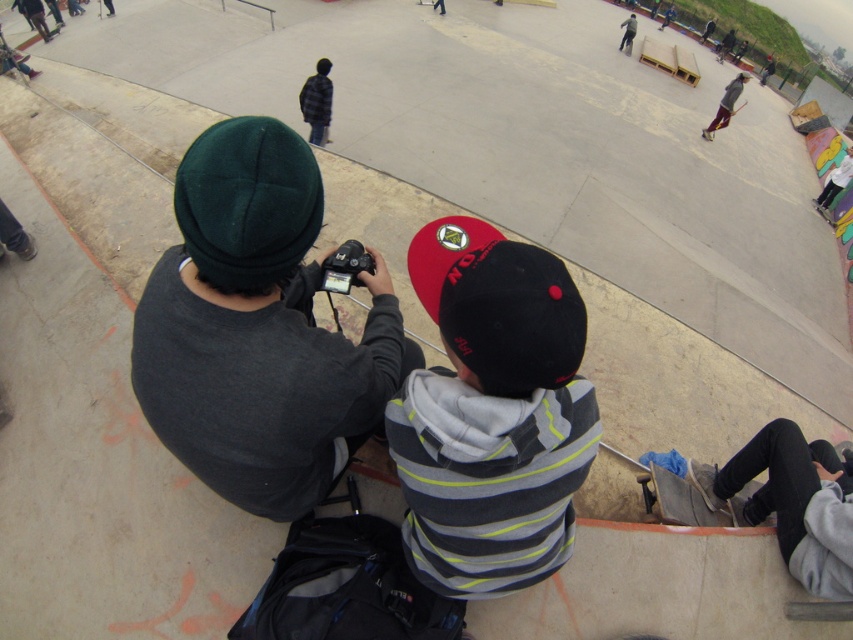
Who is taller, striped hoodie at center or wooden skateboard at lower right?

Standing taller between the two is striped hoodie at center.

Can you confirm if striped hoodie at center is shorter than wooden skateboard at lower right?

No, striped hoodie at center is not shorter than wooden skateboard at lower right.

Find the location of `striped hoodie at center`. striped hoodie at center is located at coordinates (492, 413).

This screenshot has width=853, height=640. Identify the location of striped hoodie at center. (492, 413).

Is point (234, 486) farther from camera compared to point (813, 202)?

No, it is in front of (813, 202).

Between dark gray fleece at left and wooden skateboard at center, which one appears on the left side from the viewer's perspective?

dark gray fleece at left is more to the left.

Does point (138, 378) lie behind point (821, 208)?

No, it is in front of (821, 208).

The width and height of the screenshot is (853, 640). Find the location of `dark gray fleece at left`. dark gray fleece at left is located at coordinates (258, 328).

Is wooden skateboard at lower right taller than wooden skateboard at center?

In fact, wooden skateboard at lower right may be shorter than wooden skateboard at center.

Who is more forward, (735, 509) or (833, 227)?

Positioned in front is point (735, 509).

You are a GUI agent. You are given a task and a screenshot of the screen. Output one action in this format:
    pyautogui.click(x=<x>, y=<y>)
    Task: Click on the wooden skateboard at lower right
    The width and height of the screenshot is (853, 640).
    Given the screenshot: What is the action you would take?
    pyautogui.click(x=688, y=497)